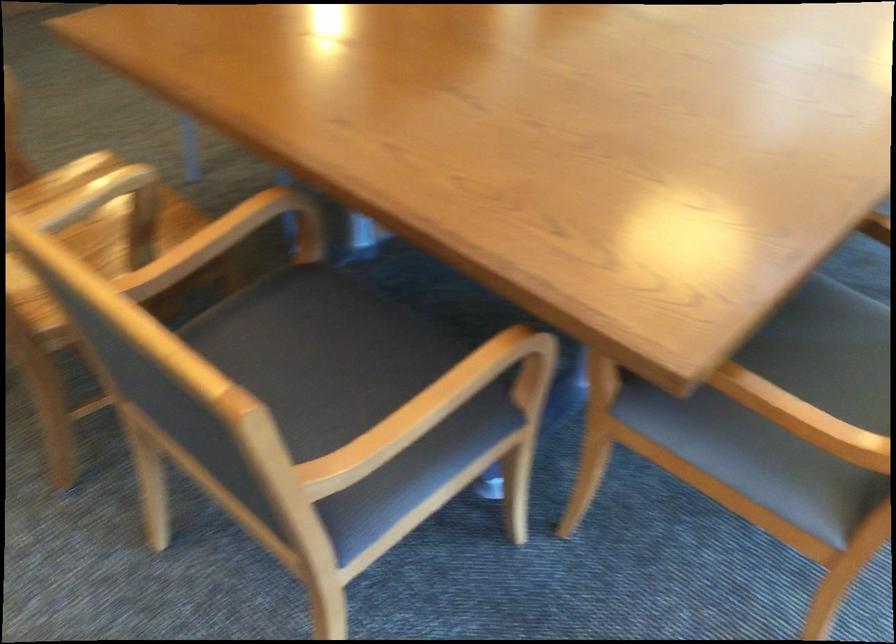
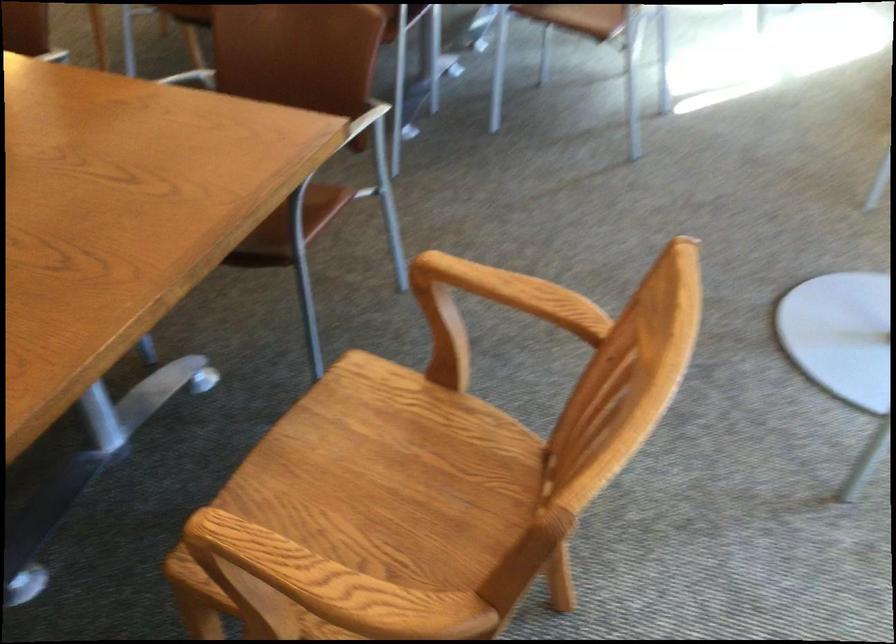
Question: The images are taken continuously from a first-person perspective. In which direction are you moving?

Choices:
 (A) Left
 (B) Right
 (C) Forward
 (D) Backward

Answer: (B)